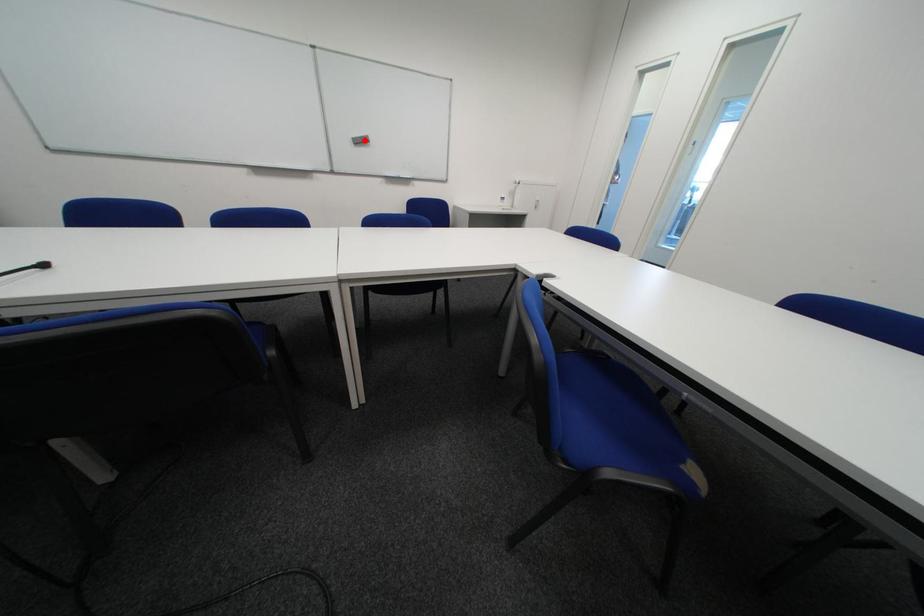
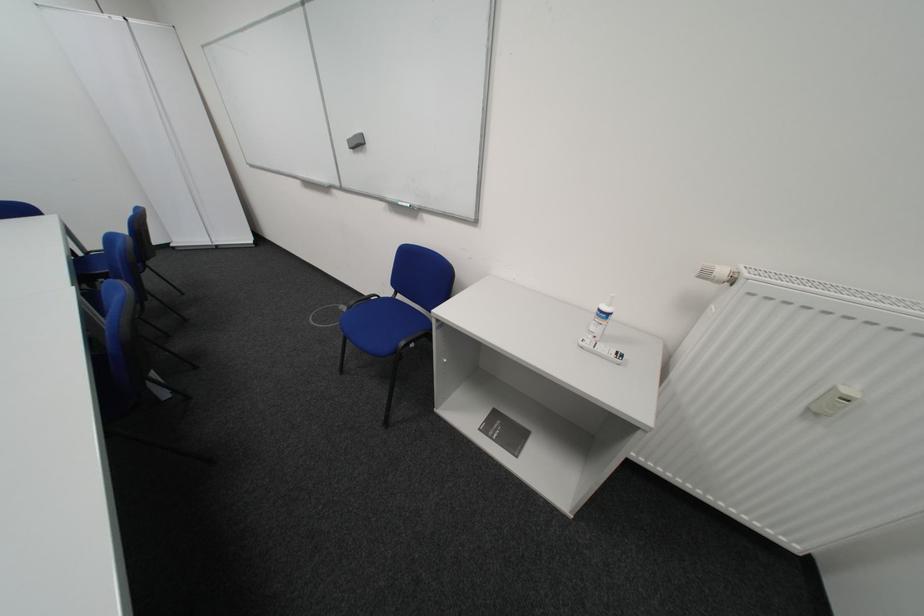
In the second image, find the point that corresponds to the highlighted location in the first image.

(361, 143)